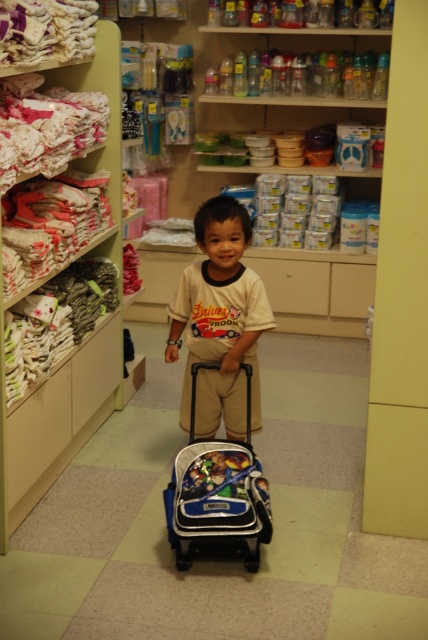
Which is in front, point (169, 355) or point (256, 528)?

Point (256, 528)

Can you confirm if beige cotton shirt at center is positioned to the left of blue fabric backpack at center?

Yes, beige cotton shirt at center is to the left of blue fabric backpack at center.

Who is more forward, (244, 316) or (246, 369)?

Answer: Positioned in front is point (246, 369).

Locate an element on the screen. The width and height of the screenshot is (428, 640). beige cotton shirt at center is located at coordinates (219, 321).